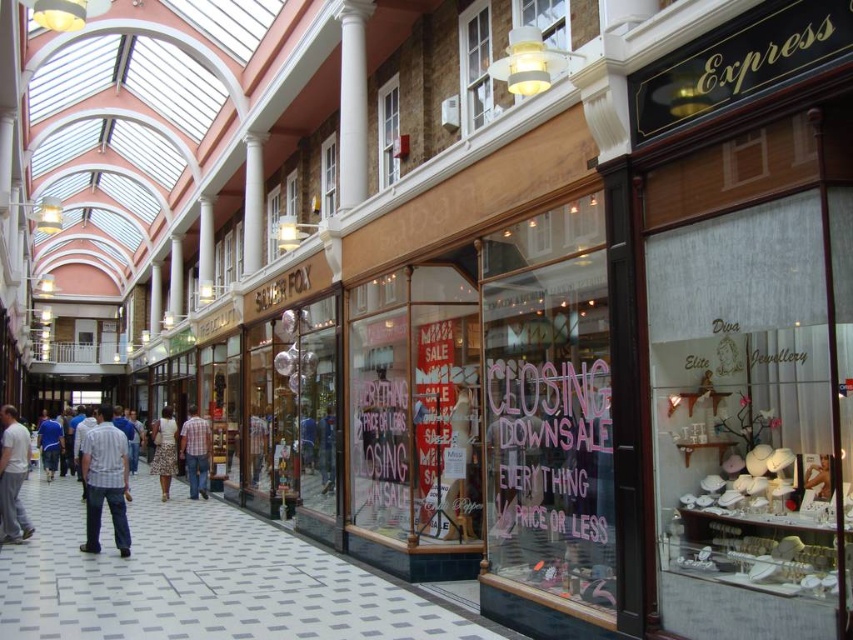
You are a customer in the shopping arcade and want to try on both the striped cotton shirt at center and the light gray cotton pants at center. Which item should you put on first to avoid having to take off the other later?

You should put on the striped cotton shirt at center first because it is in front of the light gray cotton pants at center, so removing it later wonwont require taking off the pants.

You are a delivery person carrying a package that is 3 meters long. You need to move from the transparent glass window at center to the floral skirt at center. Can you move your package horizontally through the space between them without tilting it?

The distance between the transparent glass window at center and the floral skirt at center is 28.59 meters, which is much larger than the 3 meter length of the package. Therefore, the package can be moved horizontally through the space between them without tilting.